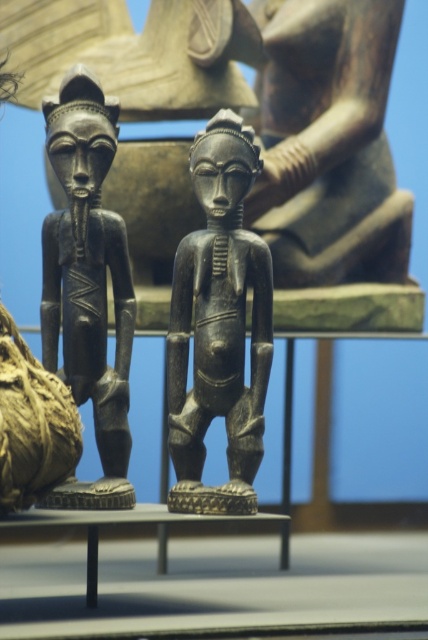
Can you confirm if black polished wood figure at center is positioned above black polished wood figurine at left?

No.

Who is shorter, black polished wood figure at center or black polished wood figurine at left?

Standing shorter between the two is black polished wood figure at center.

Between point (252, 333) and point (71, 285), which one is positioned in front?

Point (252, 333)

Find the location of a particular element. black polished wood figure at center is located at coordinates (219, 324).

Which is above, smooth dark wood figure at center or black polished wood figure at center?

smooth dark wood figure at center

Measure the distance between point (x=350, y=86) and camera.

6.12 feet

Who is more distant from viewer, (297,148) or (255,316)?

Result: The point (297,148) is more distant.

You are a GUI agent. You are given a task and a screenshot of the screen. Output one action in this format:
    pyautogui.click(x=<x>, y=<y>)
    Task: Click on the smooth dark wood figure at center
    This screenshot has width=428, height=640.
    Given the screenshot: What is the action you would take?
    pyautogui.click(x=329, y=144)

Which is in front, point (335, 52) or point (127, 323)?

Point (127, 323)

Is smooth dark wood figure at center taller than black polished wood figurine at left?

In fact, smooth dark wood figure at center may be shorter than black polished wood figurine at left.

Does point (323, 284) come closer to viewer compared to point (119, 276)?

No, (323, 284) is behind (119, 276).

Where is `smooth dark wood figure at center`? smooth dark wood figure at center is located at coordinates (329, 144).